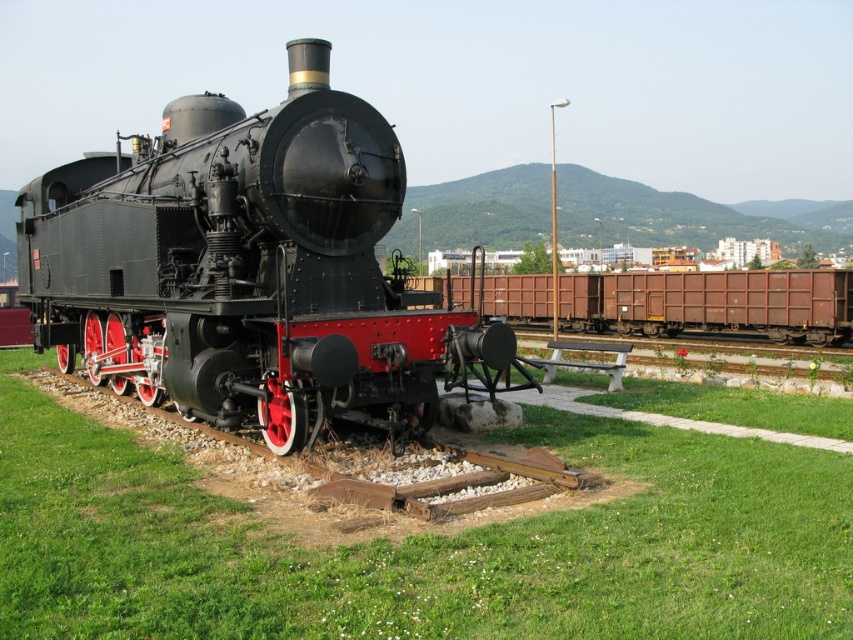
Question: Does polished black steam locomotive at center have a smaller size compared to rusty metal train car at center?

Choices:
 (A) yes
 (B) no

Answer: (B)

Question: Is polished black steam locomotive at center above rusty metal train car at center?

Choices:
 (A) yes
 (B) no

Answer: (A)

Question: Which point is farther to the camera?

Choices:
 (A) pos(262,216)
 (B) pos(836,312)

Answer: (B)

Question: Is polished black steam locomotive at center in front of rusty metal train car at center?

Choices:
 (A) yes
 (B) no

Answer: (A)